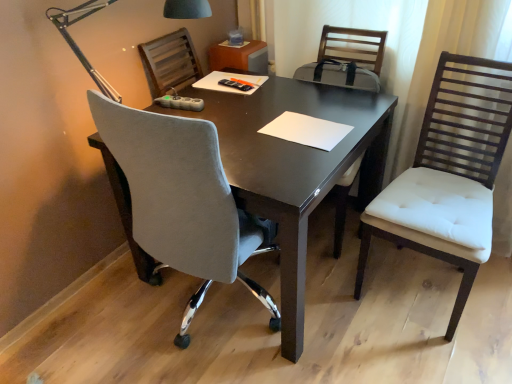
Find the location of a particular element. The height and width of the screenshot is (384, 512). vacant space in between metallic gray lamp at upper left and white paper at center is located at coordinates (256, 132).